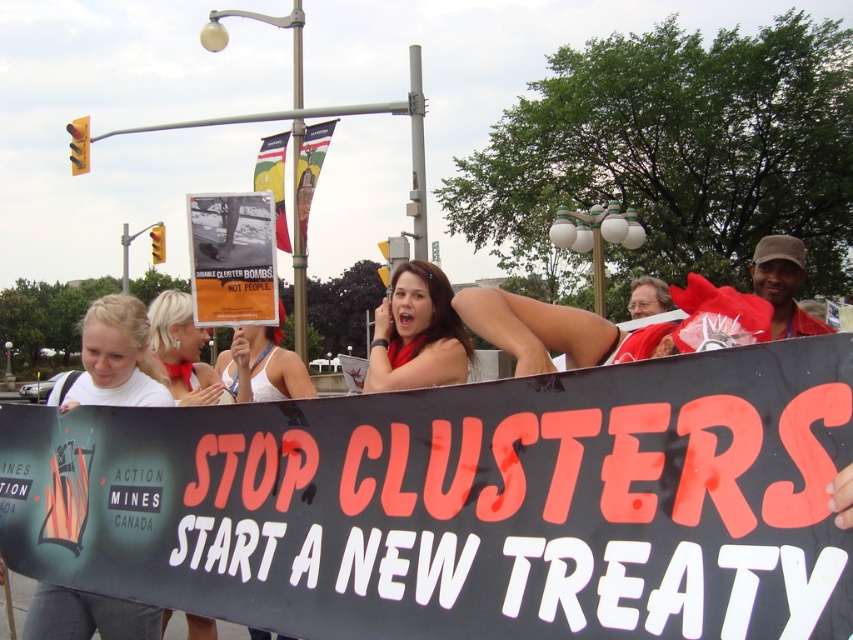
Does black fabric banner at center come behind matte red scarf at center?

No, black fabric banner at center is in front of matte red scarf at center.

Is black fabric banner at center in front of matte red scarf at center?

Yes, black fabric banner at center is in front of matte red scarf at center.

Between point (595, 624) and point (416, 348), which one is positioned in front?

Point (595, 624) is in front.

Find the location of a particular element. black fabric banner at center is located at coordinates (463, 502).

Is paper poster at center positioned behind matte red scarf at center?

Yes, it is behind matte red scarf at center.

You are a GUI agent. You are given a task and a screenshot of the screen. Output one action in this format:
    pyautogui.click(x=<x>, y=<y>)
    Task: Click on the paper poster at center
    
    Given the screenshot: What is the action you would take?
    pyautogui.click(x=231, y=259)

Is white matte t-shirt at center bigger than blonde hair at center?

No.

Which is below, white matte t-shirt at center or blonde hair at center?

blonde hair at center is below.

Locate an element on the screen. white matte t-shirt at center is located at coordinates (113, 358).